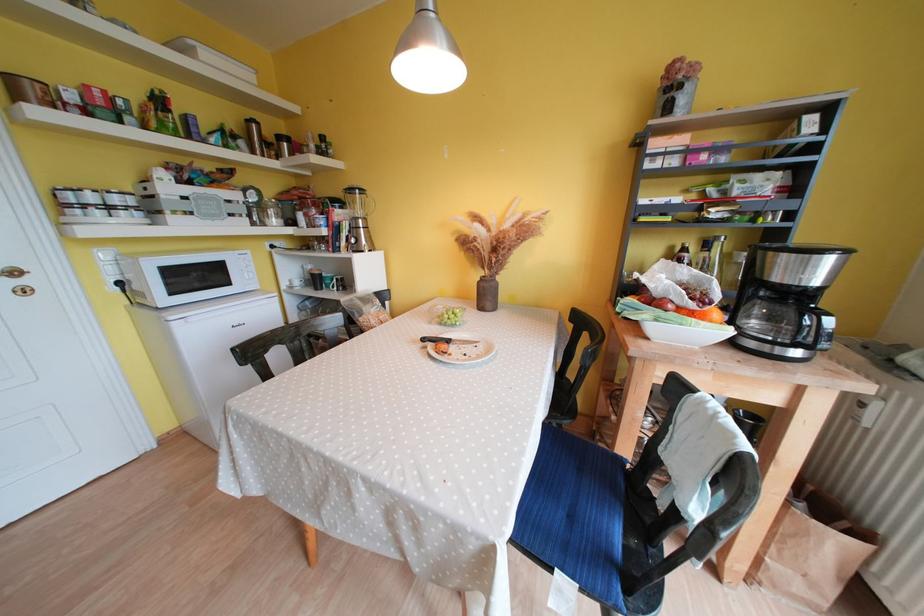
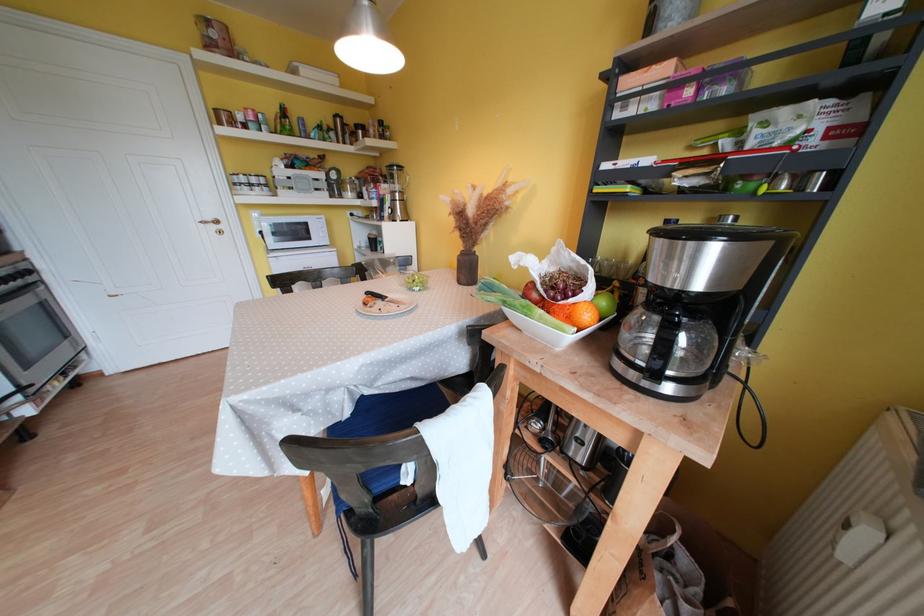
In the second image, find the point that corresponds to (x=871, y=428) in the first image.

(850, 562)